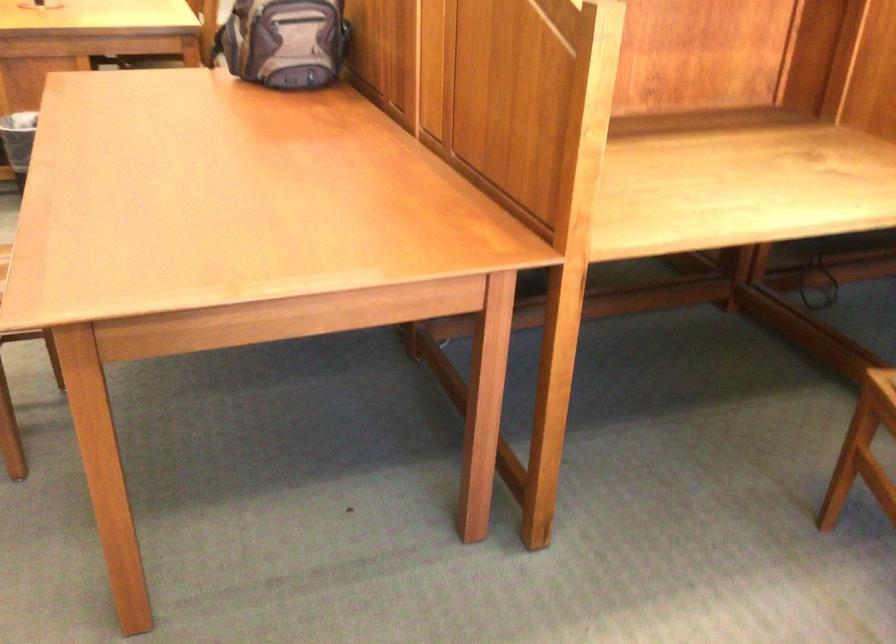
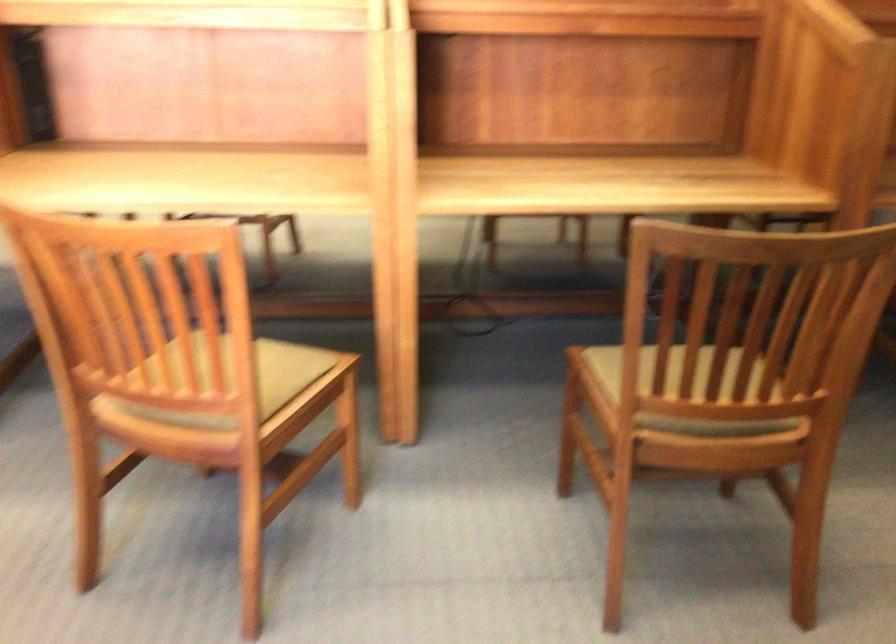
Question: What movement of the cameraman would produce the second image?

Choices:
 (A) Left
 (B) Right
 (C) Forward
 (D) Backward

Answer: (B)